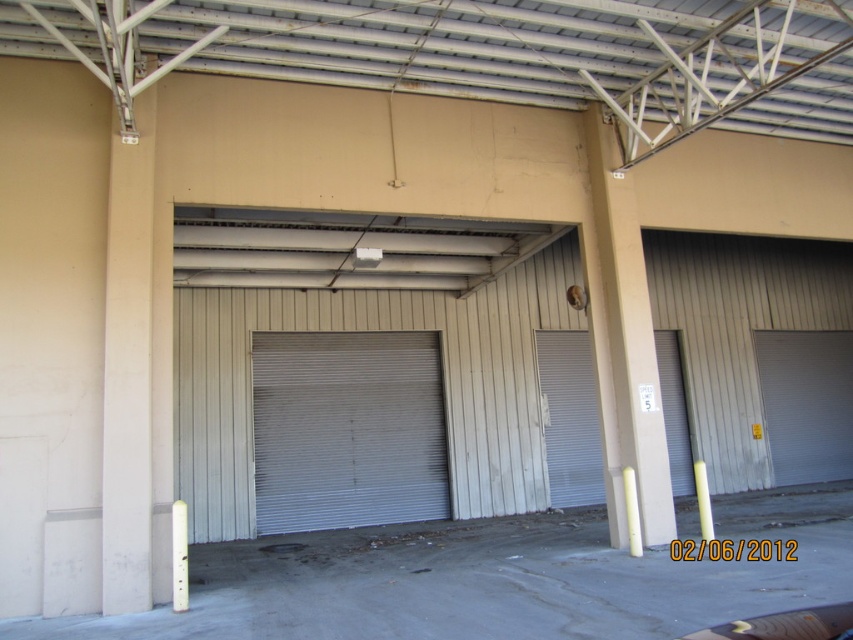
Question: Where is white corrugated metal garage door at center located in relation to white metallic door at right in the image?

Choices:
 (A) left
 (B) right

Answer: (A)

Question: Observing the image, what is the correct spatial positioning of white corrugated metal garage door at center in reference to gray metallic door at center?

Choices:
 (A) above
 (B) below

Answer: (B)

Question: Among these objects, which one is farthest from the camera?

Choices:
 (A) white metallic door at right
 (B) white corrugated metal garage door at center

Answer: (A)

Question: Does gray metallic door at center have a lesser width compared to white metallic door at right?

Choices:
 (A) no
 (B) yes

Answer: (B)

Question: Among these objects, which one is nearest to the camera?

Choices:
 (A) white corrugated metal garage door at center
 (B) gray metallic door at center

Answer: (A)

Question: Which of these objects is positioned farthest from the white metallic door at right?

Choices:
 (A) white corrugated metal garage door at center
 (B) gray metallic door at center

Answer: (A)